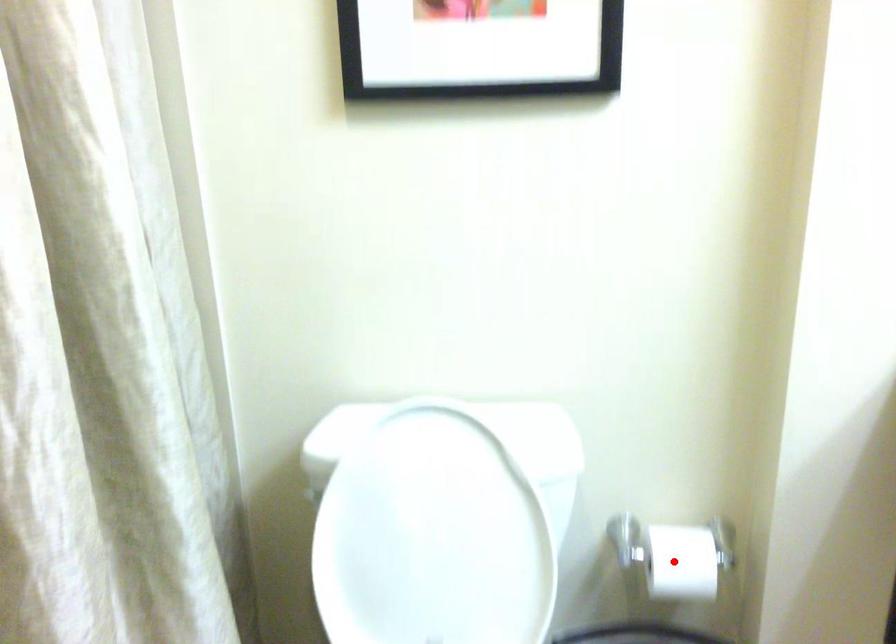
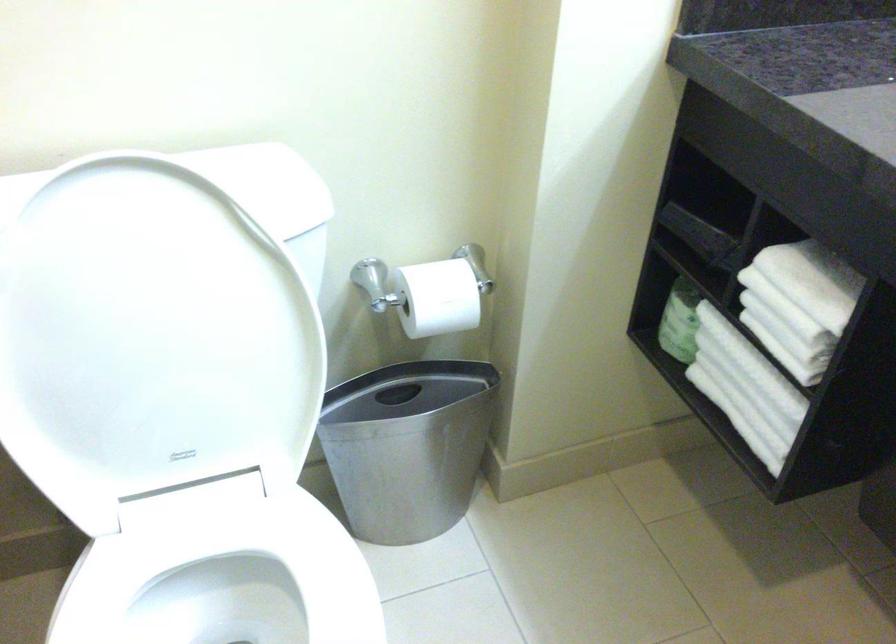
The point at the highlighted location is marked in the first image. Where is the corresponding point in the second image?

(436, 298)